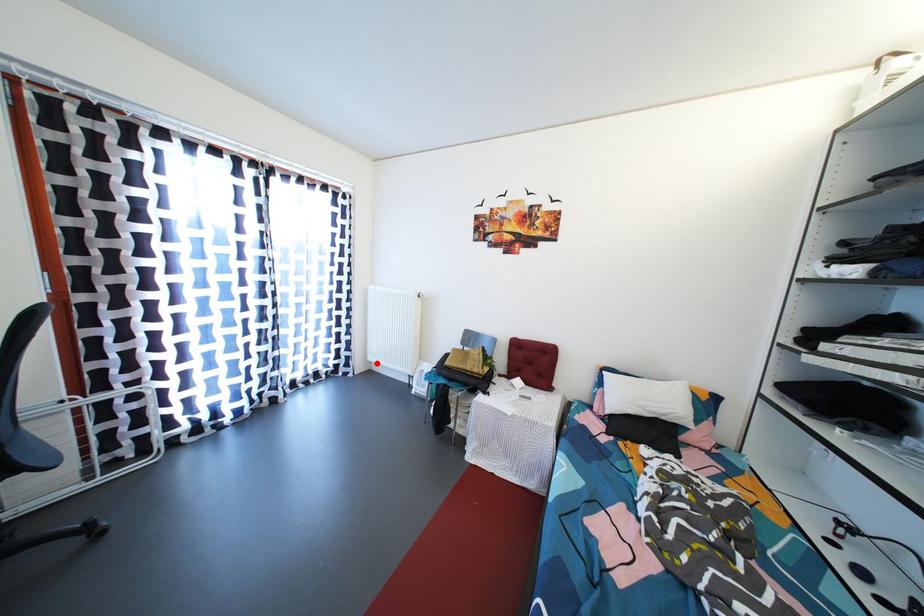
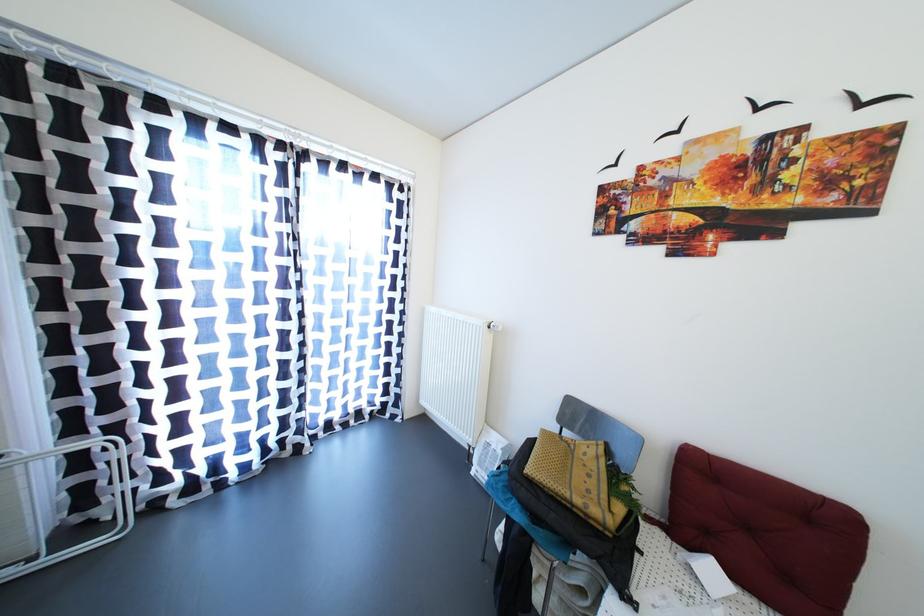
Question: A red point is marked in image1. In image2, is the corresponding 3D point closer to the camera or farther? Reply with the corresponding letter.

Choices:
 (A) The corresponding 3D point is closer.
 (B) The corresponding 3D point is farther.

Answer: (A)